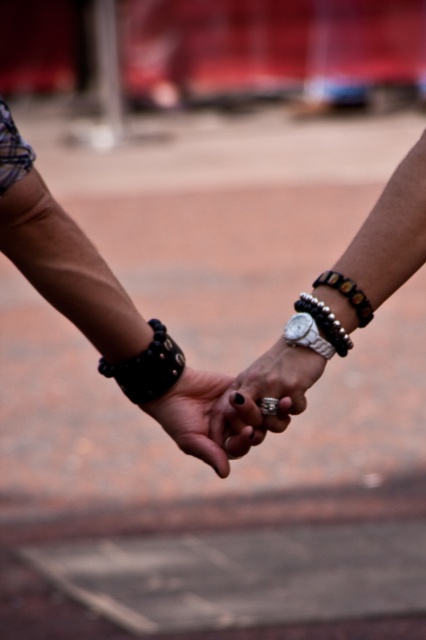
Question: Considering the real-world distances, which object is farthest from the leather studded bracelet at center?

Choices:
 (A) black leather ring at center
 (B) black beaded bracelet at center
 (C) black leather bracelet at center

Answer: (C)

Question: Is black leather ring at center wider than black leather bracelet at center?

Choices:
 (A) no
 (B) yes

Answer: (B)

Question: Does black leather ring at center appear on the right side of black leather bracelet at center?

Choices:
 (A) no
 (B) yes

Answer: (B)

Question: Which point is farther to the camera?

Choices:
 (A) (123, 388)
 (B) (210, 438)
 (C) (294, 330)

Answer: (A)

Question: Does black leather ring at center have a larger size compared to black leather bracelet at center?

Choices:
 (A) yes
 (B) no

Answer: (A)

Question: Which point is closer to the camera?

Choices:
 (A) black beaded bracelet at center
 (B) leather studded bracelet at center
 (C) black leather ring at center

Answer: (C)